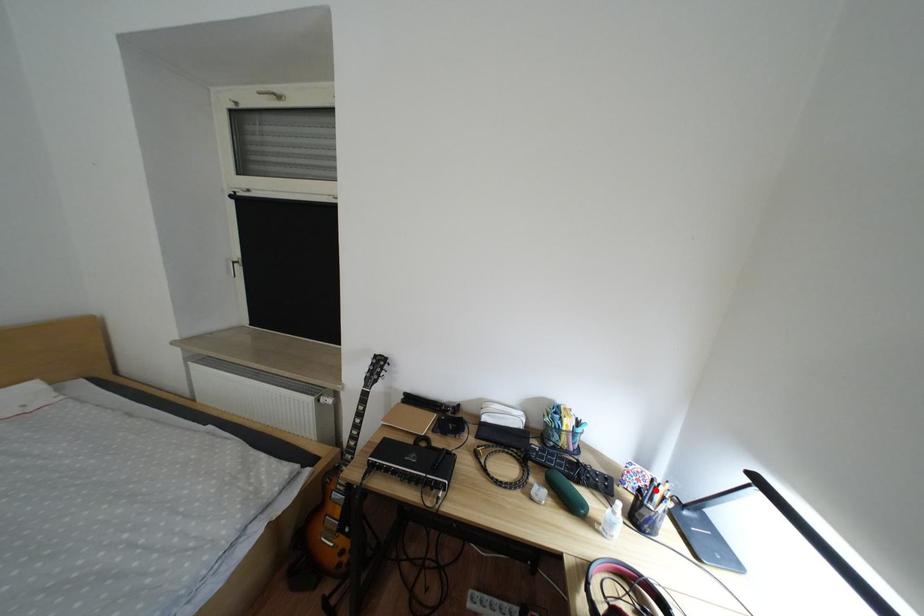
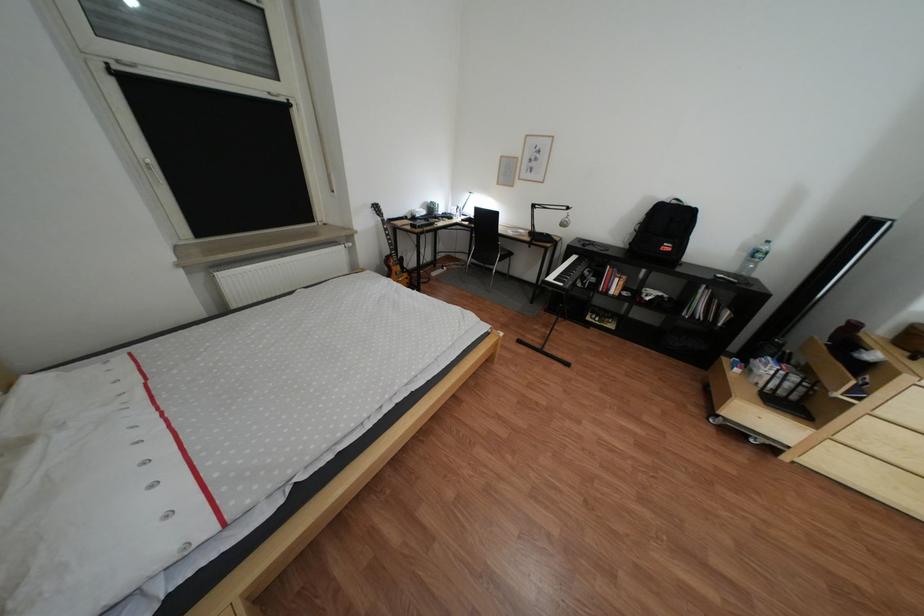
Question: I am providing you with two images of the same scene from different viewpoints. A red point is marked on the first image. Is the red point's position out of view in image 2?

Choices:
 (A) Yes
 (B) No

Answer: (A)